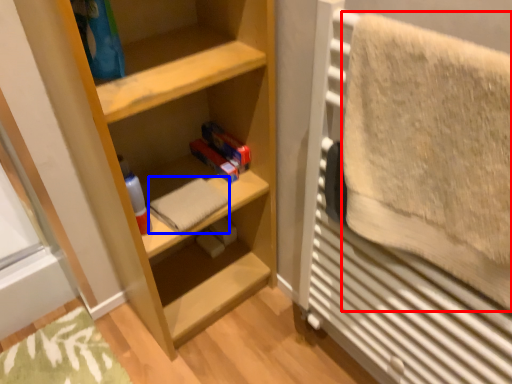
Question: Which object appears closest to the camera in this image, bath towel (highlighted by a red box) or bath towel (highlighted by a blue box)?

Choices:
 (A) bath towel
 (B) bath towel

Answer: (A)